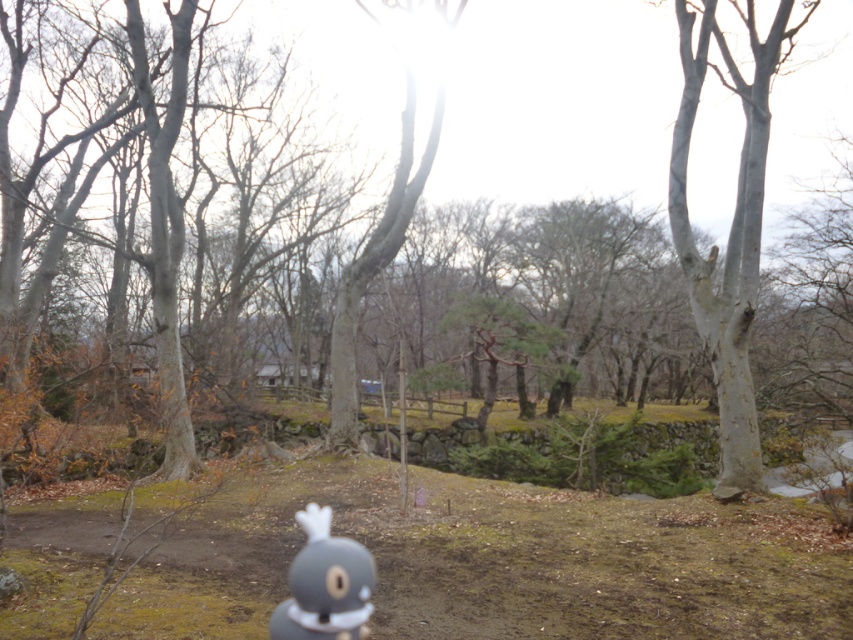
Based on the scene description, where is the smooth gray bark at center located in terms of coordinates?

The smooth gray bark at center is located at coordinates point [729,228].

You are a photographer trying to capture both the smooth gray bark at center and the gray matte plush toy at lower center in a single shot. Based on their sizes in the image, which object will appear larger in your photo?

The smooth gray bark at center appears larger in the photo because it is much taller than the gray matte plush toy at lower center.